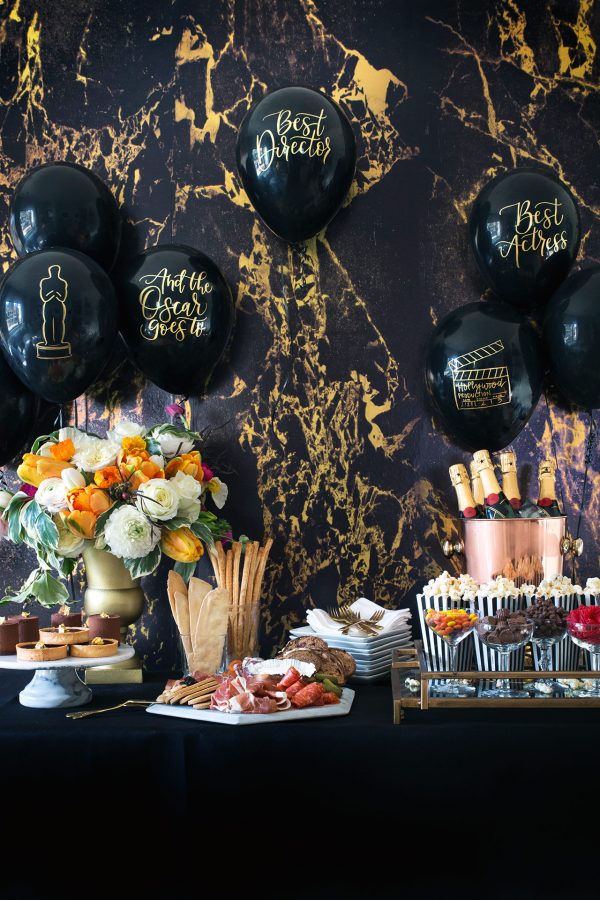
Locate an element on the screen. This screenshot has height=900, width=600. utensils is located at coordinates (337, 610), (346, 615), (353, 617), (373, 619), (365, 632), (105, 709).